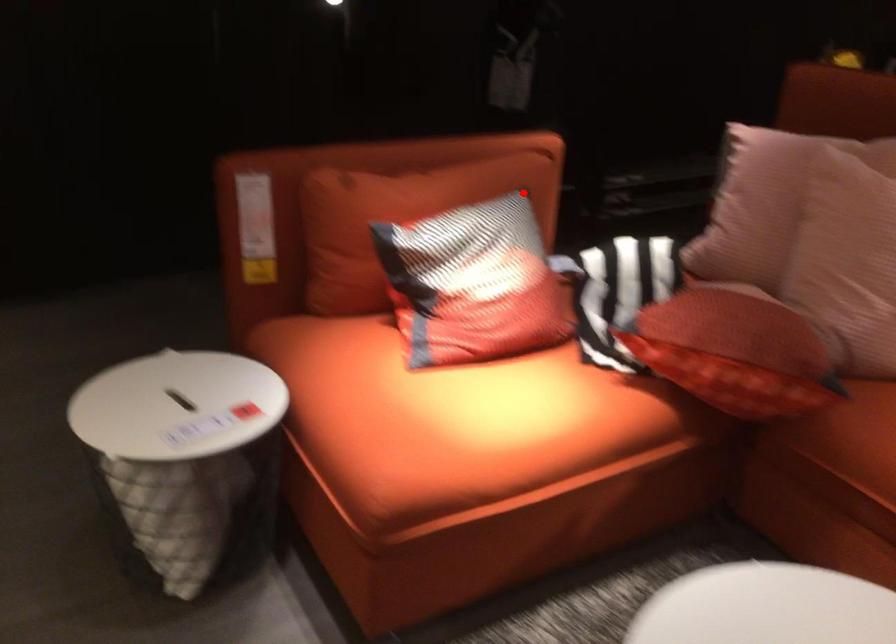
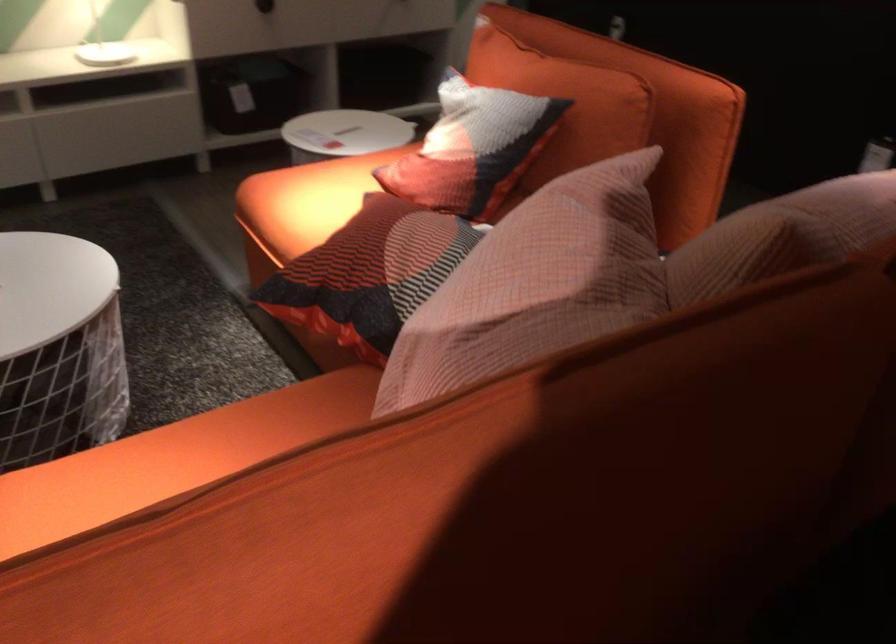
Find the pixel in the second image that matches the highlighted location in the first image.

(564, 102)